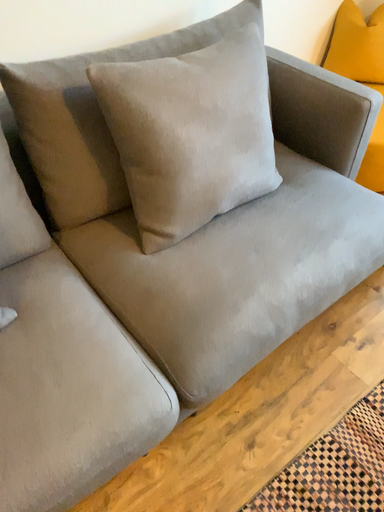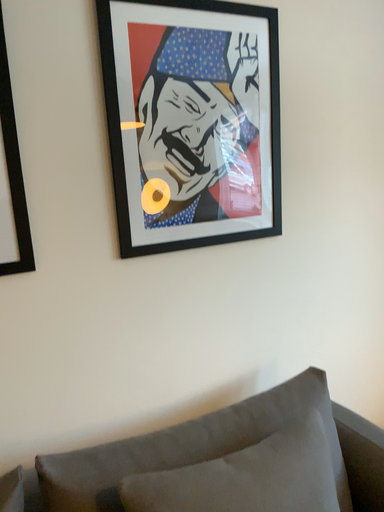
Question: How did the camera likely rotate when shooting the video?

Choices:
 (A) rotated left
 (B) rotated right

Answer: (A)